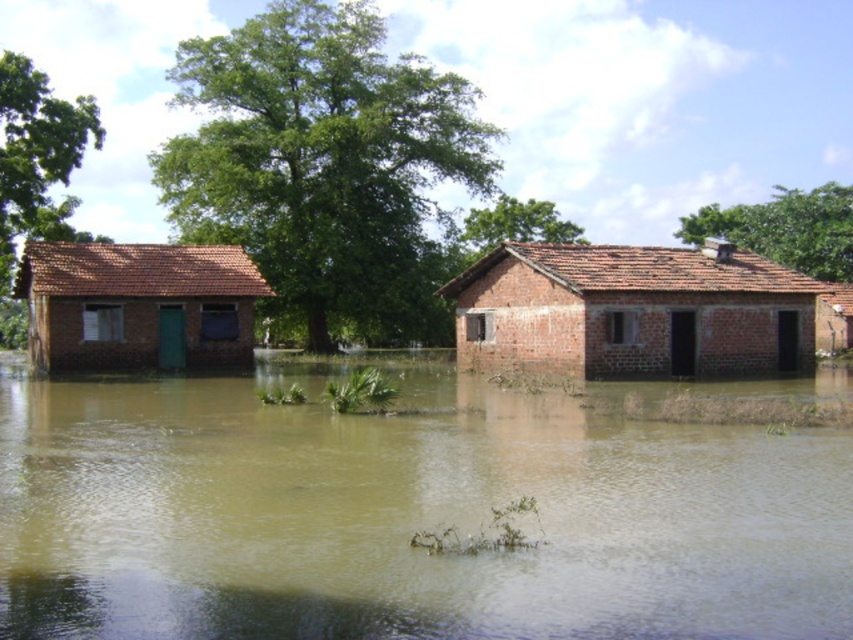
You are standing at the origin point of the image. Which direction should you move to reach the brick house at right?

The brick house at right is located at point (631, 310). Since the coordinate system is normalized, moving towards the right and upward from the origin will lead you to the brick house at right.

You are a rescue worker trying to reach the matte brick house at left during a flood. Based on the scene, can you determine if the brown muddy water at center is blocking the path to the house?

The brown muddy water at center is located below the matte brick house at left, so it is blocking the path to the matte brick house at left.